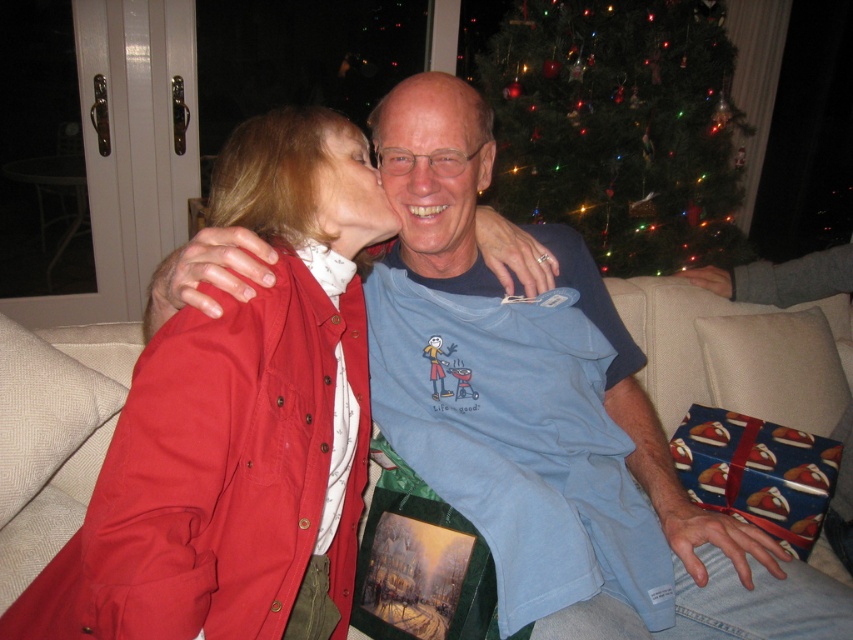
Question: Which is farther from the matte blue shirt at center?

Choices:
 (A) green textured christmas tree at upper center
 (B) blue cotton t-shirt at center

Answer: (A)

Question: Which of the following is the closest to the observer?

Choices:
 (A) matte blue t-shirt at center
 (B) blue cotton t-shirt at center
 (C) green textured christmas tree at upper center
 (D) matte blue shirt at center

Answer: (B)

Question: From the image, what is the correct spatial relationship of green textured christmas tree at upper center in relation to matte blue shirt at center?

Choices:
 (A) below
 (B) above

Answer: (B)

Question: Is blue cotton t-shirt at center smaller than matte blue shirt at center?

Choices:
 (A) no
 (B) yes

Answer: (A)

Question: Is the position of green textured christmas tree at upper center more distant than that of matte blue t-shirt at center?

Choices:
 (A) yes
 (B) no

Answer: (A)

Question: Which point is closer to the camera taking this photo?

Choices:
 (A) coord(343,248)
 (B) coord(463,166)
 (C) coord(537,26)
 (D) coord(485,420)

Answer: (A)